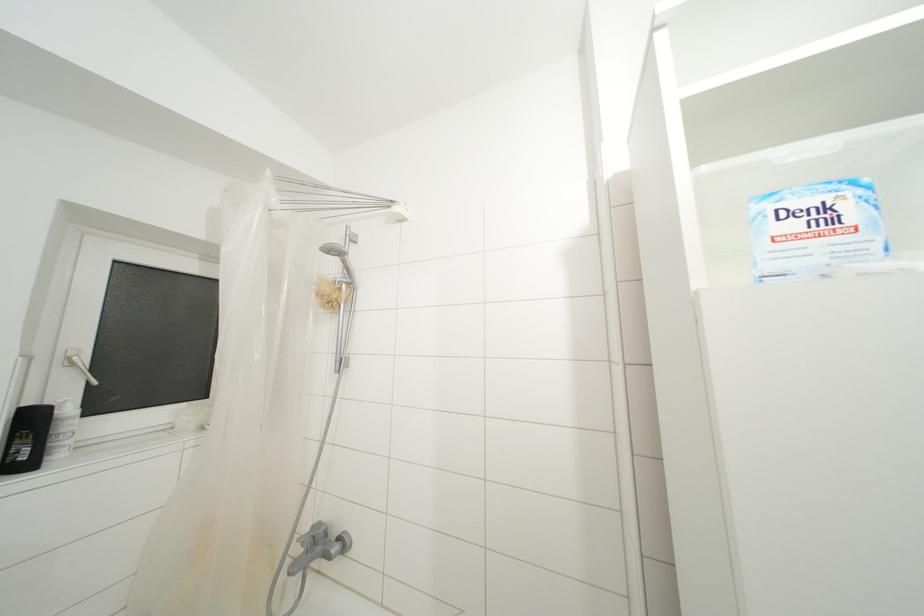
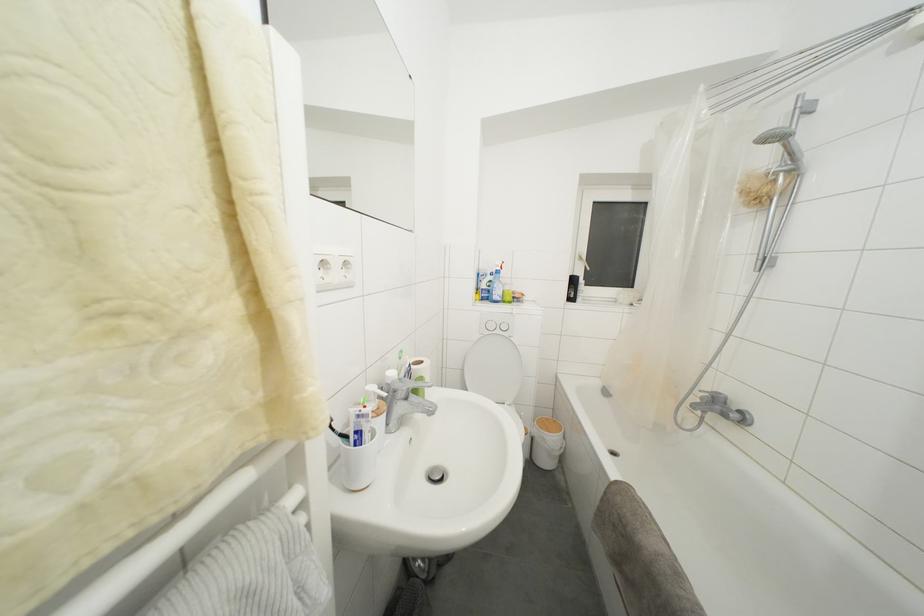
Question: The images are taken continuously from a first-person perspective. In which direction is your viewpoint rotating?

Choices:
 (A) Left
 (B) Right
 (C) Up
 (D) Down

Answer: (A)